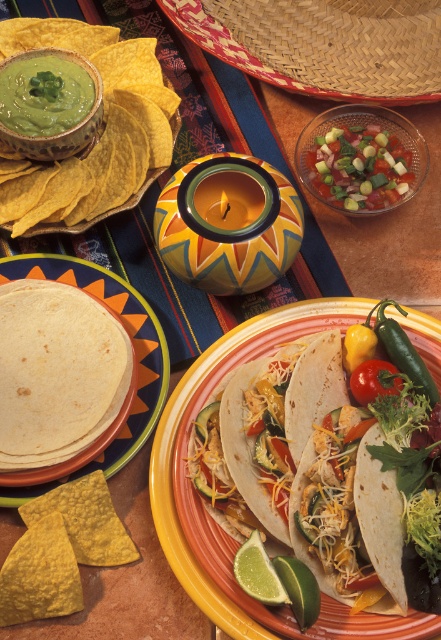
Question: Is chopped green vegetables at center wider than green matte bowl at upper left?

Choices:
 (A) yes
 (B) no

Answer: (A)

Question: Can you confirm if woven straw sombrero at upper center is positioned above green matte lime at lower center?

Choices:
 (A) yes
 (B) no

Answer: (A)

Question: Which point is closer to the camera taking this photo?

Choices:
 (A) (22, 29)
 (B) (254, 554)

Answer: (B)

Question: Among these objects, which one is nearest to the camera?

Choices:
 (A) green matte bowl at upper left
 (B) chopped green vegetables at center
 (C) green matte lime at lower center
 (D) soft tortilla at center

Answer: (D)

Question: Does white tortilla at center appear over green matte bowl at upper left?

Choices:
 (A) yes
 (B) no

Answer: (B)

Question: Which is farther from the green matte lime at lower center?

Choices:
 (A) chopped green vegetables at center
 (B) woven straw sombrero at upper center

Answer: (B)